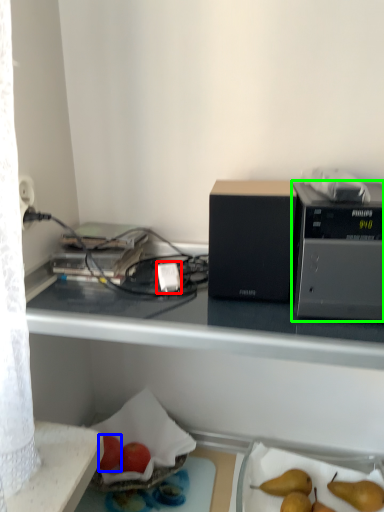
Question: Considering the real-world distances, which object is farthest from power plugs and sockets (highlighted by a red box)? apple (highlighted by a blue box) or appliance (highlighted by a green box)?

Choices:
 (A) apple
 (B) appliance

Answer: (A)